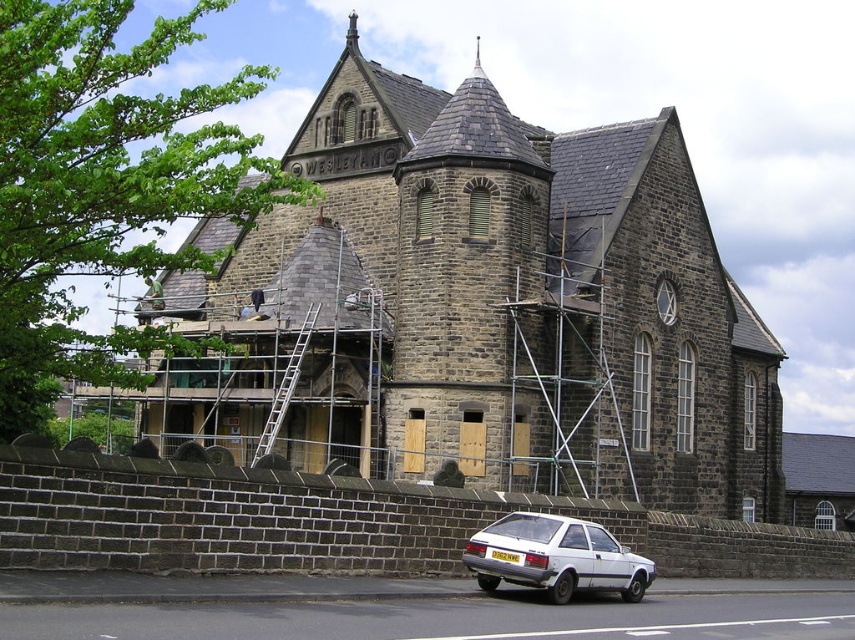
Does point (600, 156) come in front of point (587, 573)?

That is False.

Between point (500, 248) and point (581, 525), which one is positioned behind?

The point (500, 248) is more distant.

Find the location of `dark gray stone church at center`. dark gray stone church at center is located at coordinates (491, 305).

Who is positioned more to the left, white matte hatchback at lower center or silver metallic ladder at center?

silver metallic ladder at center

Does white matte hatchback at lower center come in front of silver metallic ladder at center?

Yes, white matte hatchback at lower center is closer to the viewer.

Where is `white matte hatchback at lower center`? The image size is (855, 640). white matte hatchback at lower center is located at coordinates (555, 557).

The height and width of the screenshot is (640, 855). Identify the location of white matte hatchback at lower center. (555, 557).

Can you confirm if dark gray stone church at center is taller than silver metallic ladder at center?

Indeed, dark gray stone church at center has a greater height compared to silver metallic ladder at center.

Between dark gray stone church at center and silver metallic ladder at center, which one is positioned lower?

Positioned lower is silver metallic ladder at center.

Which is behind, point (423, 388) or point (308, 339)?

Point (308, 339)

You are a GUI agent. You are given a task and a screenshot of the screen. Output one action in this format:
    pyautogui.click(x=<x>, y=<y>)
    Task: Click on the dark gray stone church at center
    Image resolution: width=855 pixels, height=640 pixels.
    Given the screenshot: What is the action you would take?
    pyautogui.click(x=491, y=305)